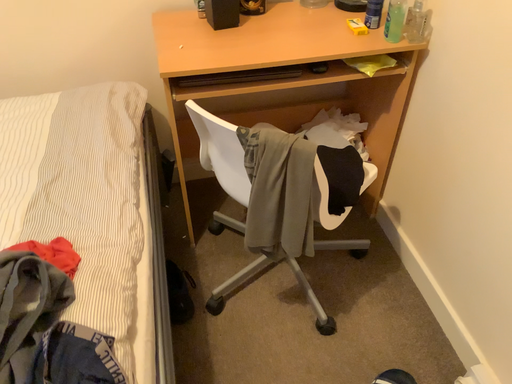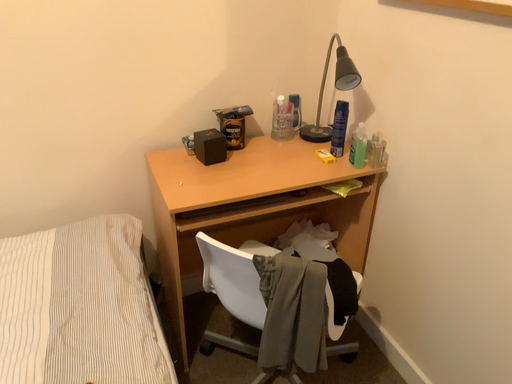
Question: How did the camera likely rotate when shooting the video?

Choices:
 (A) rotated downward
 (B) rotated upward

Answer: (B)